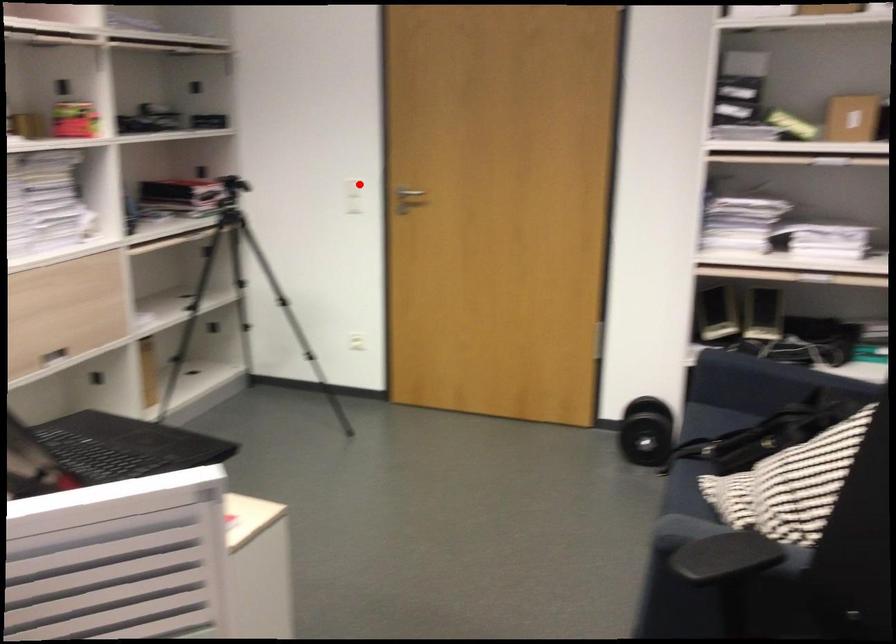
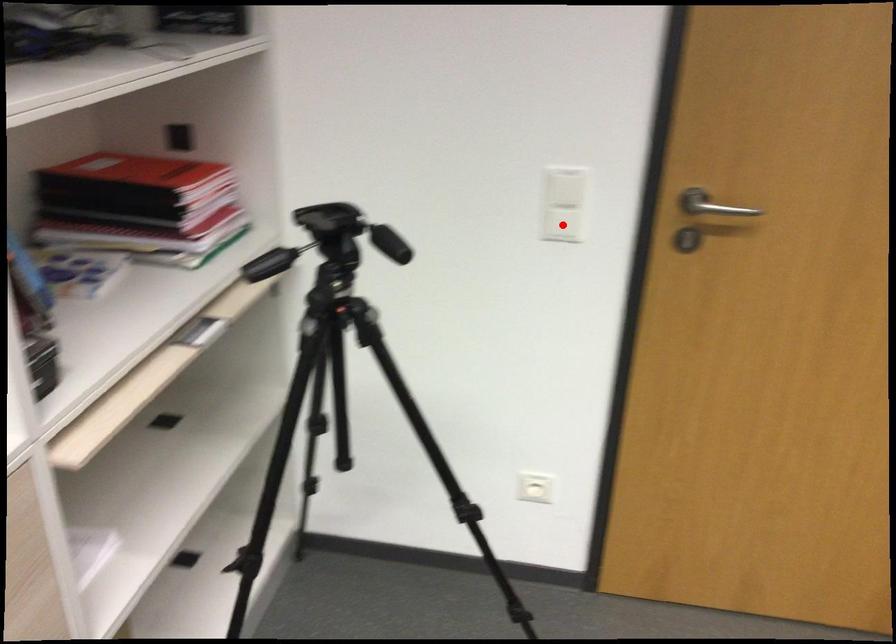
I am providing you with two images of the same scene from different viewpoints. A red point is marked on the first image and another point is marked on the second image. Are the points marked in image1 and image2 representing the same 3D position?

No